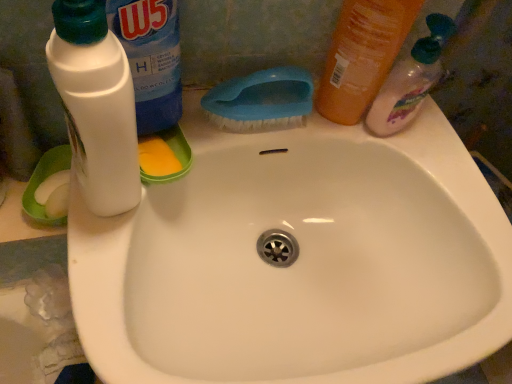
Where is `vacant space in front of translucent plastic bottle at upper right, which is the third cleaning product in left-to-right order`? This screenshot has width=512, height=384. vacant space in front of translucent plastic bottle at upper right, which is the third cleaning product in left-to-right order is located at coordinates (426, 193).